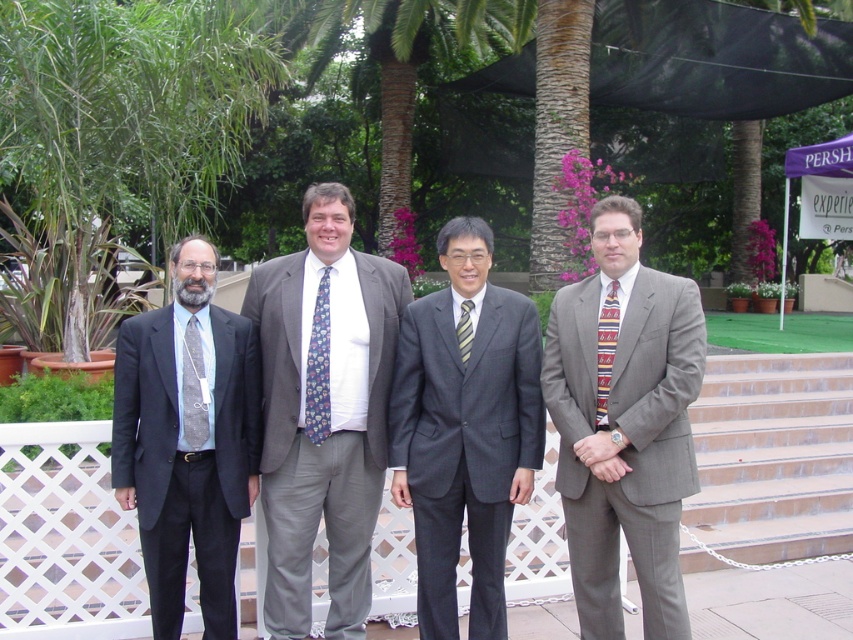
Question: Is white lattice fence at center behind dark gray suit at center?

Choices:
 (A) yes
 (B) no

Answer: (A)

Question: Based on their relative distances, which object is nearer to the dark gray suit at center?

Choices:
 (A) multicolored woven tie at right
 (B) gray fabric tie at left
 (C) matte gray suit at left
 (D) matte gray suit at center

Answer: (D)

Question: Which point is closer to the camera?

Choices:
 (A) white lattice fence at center
 (B) matte gray suit at center
 (C) gray fabric tie at left
 (D) blue floral tie at center

Answer: (C)

Question: Does white lattice fence at center appear on the left side of striped fabric tie at center?

Choices:
 (A) no
 (B) yes

Answer: (B)

Question: Does blue floral tie at center have a larger size compared to gray fabric tie at left?

Choices:
 (A) no
 (B) yes

Answer: (B)

Question: Estimate the real-world distances between objects in this image. Which object is farther from the matte gray suit at center?

Choices:
 (A) striped fabric tie at center
 (B) white lattice fence at center

Answer: (B)